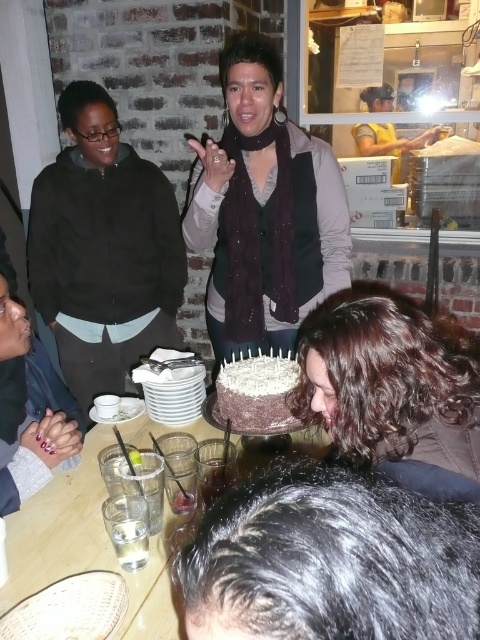
You are a photographer at the event and want to capture a photo of both the dark brown curly hair at lower center and the chocolate frosted cake at center without any obstruction. Given their sizes, which one might you need to adjust your camera angle for to ensure it fits in the frame?

The dark brown curly hair at lower center is much taller than the chocolate frosted cake at center, so you would need to adjust your camera angle to accommodate its height to ensure both fit in the frame.

In the scene described, there is a matte black jacket at left located at point (104, 250). If you were to place a small gift box on the table where the cake is, would the matte black jacket at left be visible from the gift box location?

The matte black jacket at left is located at point (104, 250). Since the jacket is at the left side of the scene and the cake is on the table in the center, placing the gift box on the table would allow visibility of the jacket from that position.

You are planning to place a rectangular gift box on the table. The gift box is as wide as the matte black jacket at left. Will the gift box fit on the wooden table at center without overhanging the edges?

The matte black jacket at left has a lesser width compared to wooden table at center, so the gift box, which is as wide as the matte black jacket at left, will fit on the wooden table at center without overhanging the edges since the table is wider.